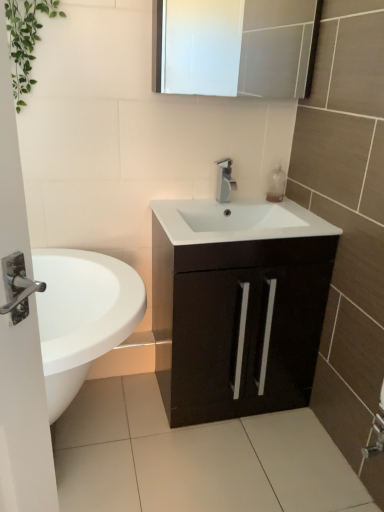
Question: Considering the relative positions of green leafy plant at upper left and silver metallic faucet at center in the image provided, is green leafy plant at upper left in front of silver metallic faucet at center?

Choices:
 (A) no
 (B) yes

Answer: (B)

Question: Is green leafy plant at upper left at the left side of silver metallic faucet at center?

Choices:
 (A) yes
 (B) no

Answer: (A)

Question: Considering the relative sizes of green leafy plant at upper left and silver metallic faucet at center in the image provided, is green leafy plant at upper left shorter than silver metallic faucet at center?

Choices:
 (A) yes
 (B) no

Answer: (B)

Question: Is green leafy plant at upper left looking in the opposite direction of silver metallic faucet at center?

Choices:
 (A) yes
 (B) no

Answer: (B)

Question: Does green leafy plant at upper left appear on the right side of silver metallic faucet at center?

Choices:
 (A) yes
 (B) no

Answer: (B)

Question: Choose the correct answer: Is green leafy plant at upper left inside silver metallic faucet at center or outside it?

Choices:
 (A) outside
 (B) inside

Answer: (A)

Question: Is point (39, 38) positioned closer to the camera than point (218, 196)?

Choices:
 (A) closer
 (B) farther

Answer: (A)

Question: From a real-world perspective, is green leafy plant at upper left physically located above or below silver metallic faucet at center?

Choices:
 (A) above
 (B) below

Answer: (A)

Question: Considering the positions of green leafy plant at upper left and silver metallic faucet at center in the image, is green leafy plant at upper left wider or thinner than silver metallic faucet at center?

Choices:
 (A) thin
 (B) wide

Answer: (B)

Question: In the image, is matte black cabinet at center positioned in front of or behind green leafy plant at upper left?

Choices:
 (A) behind
 (B) front

Answer: (A)

Question: Considering the positions of point (299, 309) and point (38, 3), is point (299, 309) closer or farther from the camera than point (38, 3)?

Choices:
 (A) closer
 (B) farther

Answer: (B)

Question: Would you say matte black cabinet at center is to the left or to the right of green leafy plant at upper left in the picture?

Choices:
 (A) left
 (B) right

Answer: (B)

Question: Considering the positions of matte black cabinet at center and green leafy plant at upper left in the image, is matte black cabinet at center bigger or smaller than green leafy plant at upper left?

Choices:
 (A) big
 (B) small

Answer: (A)

Question: Do you think matte black cabinet at center is within translucent plastic soap dispenser at upper right, or outside of it?

Choices:
 (A) outside
 (B) inside

Answer: (A)

Question: Based on their positions, is matte black cabinet at center located to the left or right of translucent plastic soap dispenser at upper right?

Choices:
 (A) right
 (B) left

Answer: (B)